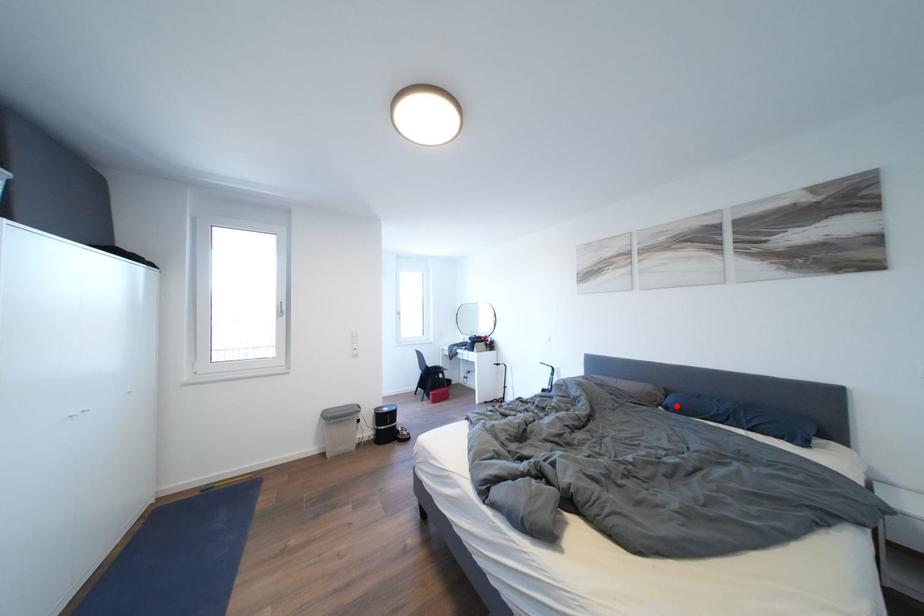
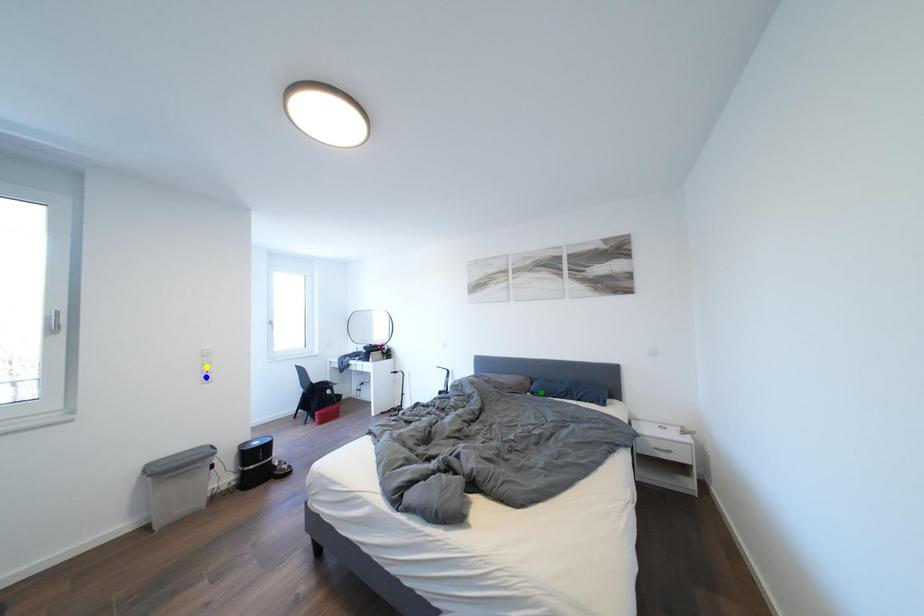
Question: I am providing you with two images of the same scene from different viewpoints. A red point is marked on the first image. You are given multiple points on the second image. Which spot in image 2 lines up with the point in image 1?

Choices:
 (A) yellow point
 (B) green point
 (C) blue point

Answer: (B)